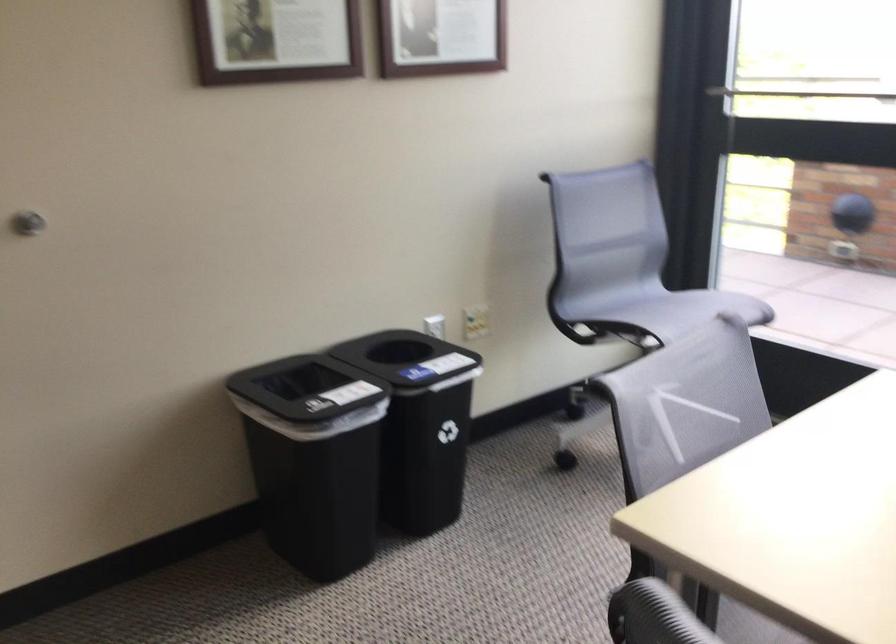
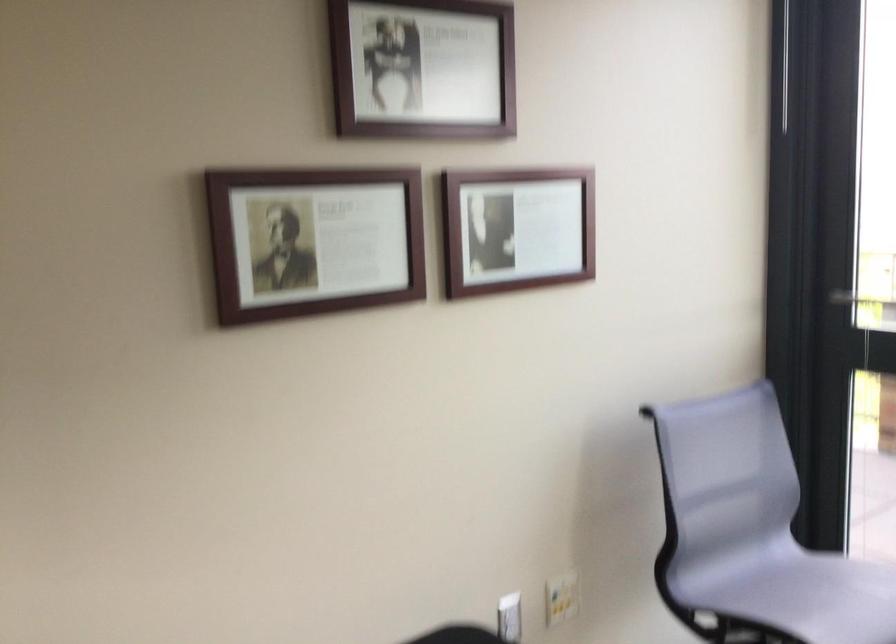
Question: The images are taken continuously from a first-person perspective. In which direction are you moving?

Choices:
 (A) Left
 (B) Right
 (C) Forward
 (D) Backward

Answer: (C)